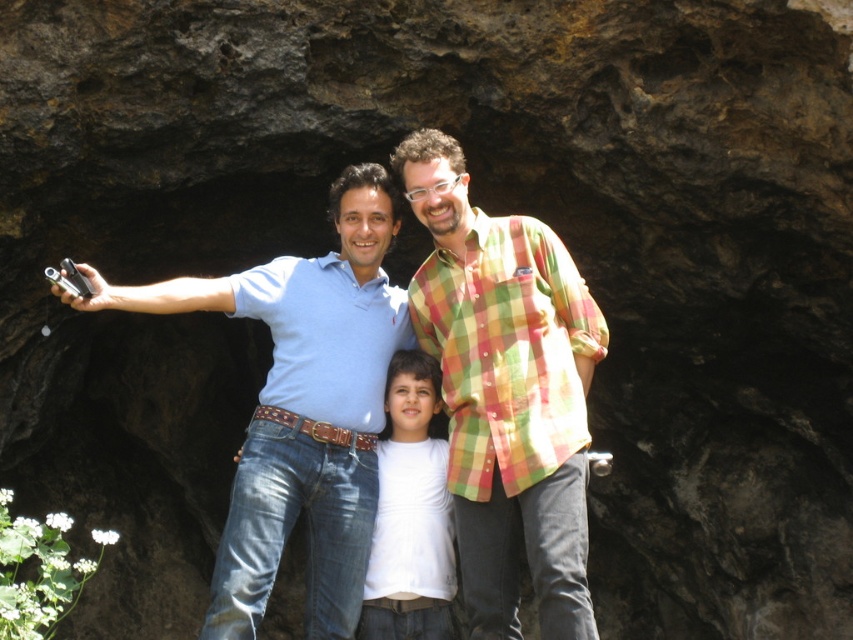
Is point (410, 202) behind point (364, 291)?

No, (410, 202) is closer to viewer.

Find the location of a particular element. checkered fabric shirt at center is located at coordinates (506, 392).

The height and width of the screenshot is (640, 853). What do you see at coordinates (506, 392) in the screenshot? I see `checkered fabric shirt at center` at bounding box center [506, 392].

Is checkered fabric shirt at center above white matte shirt at center?

Indeed, checkered fabric shirt at center is positioned over white matte shirt at center.

What do you see at coordinates (506, 392) in the screenshot? The height and width of the screenshot is (640, 853). I see `checkered fabric shirt at center` at bounding box center [506, 392].

Identify the location of checkered fabric shirt at center. (506, 392).

Does matte blue shirt at center have a greater height compared to white matte shirt at center?

Yes, matte blue shirt at center is taller than white matte shirt at center.

Is matte blue shirt at center to the right of white matte shirt at center from the viewer's perspective?

No, matte blue shirt at center is not to the right of white matte shirt at center.

Is point (236, 300) closer to viewer compared to point (413, 484)?

Yes, it is.

Where is `matte blue shirt at center`? matte blue shirt at center is located at coordinates (300, 406).